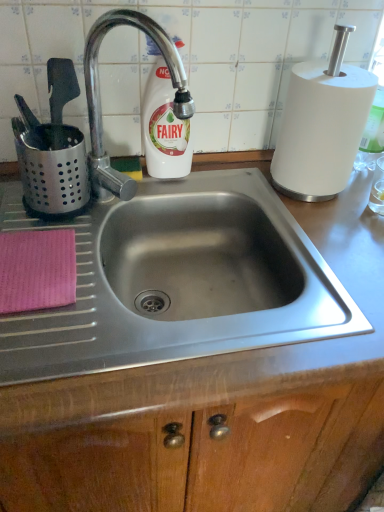
Where is `free region on the left part of white matte paper towel at upper right`? free region on the left part of white matte paper towel at upper right is located at coordinates (227, 174).